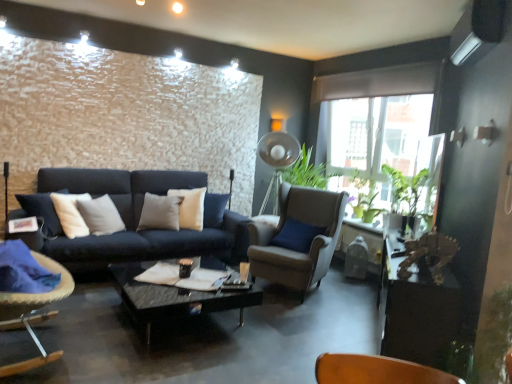
Question: Is green matte plant at right to the left of velvet cushioned chair at left, the first chair in the left-to-right sequence, from the viewer's perspective?

Choices:
 (A) yes
 (B) no

Answer: (B)

Question: From a real-world perspective, is green matte plant at right over velvet cushioned chair at left, which ranks as the 2th chair in right-to-left order?

Choices:
 (A) yes
 (B) no

Answer: (A)

Question: Is green matte plant at right far from velvet cushioned chair at left, the first chair in the left-to-right sequence?

Choices:
 (A) yes
 (B) no

Answer: (A)

Question: Is velvet cushioned chair at left, the first chair in the left-to-right sequence, at the back of green matte plant at right?

Choices:
 (A) yes
 (B) no

Answer: (B)

Question: Can you confirm if green matte plant at right is bigger than velvet cushioned chair at left, the first chair in the left-to-right sequence?

Choices:
 (A) no
 (B) yes

Answer: (A)

Question: Is point (152, 291) closer or farther from the camera than point (250, 254)?

Choices:
 (A) closer
 (B) farther

Answer: (A)

Question: Based on their sizes in the image, would you say black glass coffee table at center is bigger or smaller than suede beige armchair at center, the first chair when ordered from back to front?

Choices:
 (A) big
 (B) small

Answer: (B)

Question: From the image's perspective, is black glass coffee table at center positioned above or below suede beige armchair at center, which appears as the second chair when viewed from the front?

Choices:
 (A) above
 (B) below

Answer: (B)

Question: Is black glass coffee table at center wider or thinner than suede beige armchair at center, which appears as the second chair when viewed from the front?

Choices:
 (A) wide
 (B) thin

Answer: (A)

Question: From the image's perspective, is suede beige armchair at center, which appears as the second chair when viewed from the front, above or below wooden table at right?

Choices:
 (A) below
 (B) above

Answer: (B)

Question: Is suede beige armchair at center, positioned as the second chair in left-to-right order, taller or shorter than wooden table at right?

Choices:
 (A) tall
 (B) short

Answer: (A)

Question: Is point (290, 200) positioned closer to the camera than point (419, 352)?

Choices:
 (A) farther
 (B) closer

Answer: (A)

Question: From a real-world perspective, is suede beige armchair at center, marked as the first chair in a right-to-left arrangement, above or below wooden table at right?

Choices:
 (A) below
 (B) above

Answer: (B)

Question: Is wooden table at right wider or thinner than black glass coffee table at center?

Choices:
 (A) thin
 (B) wide

Answer: (A)

Question: Is wooden table at right inside or outside of black glass coffee table at center?

Choices:
 (A) inside
 (B) outside

Answer: (B)